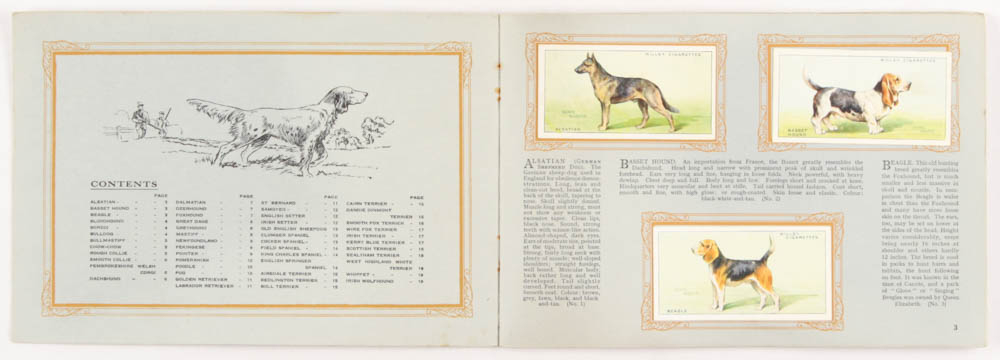
In order to click on frame in this screenshot , I will do `click(46, 194)`.